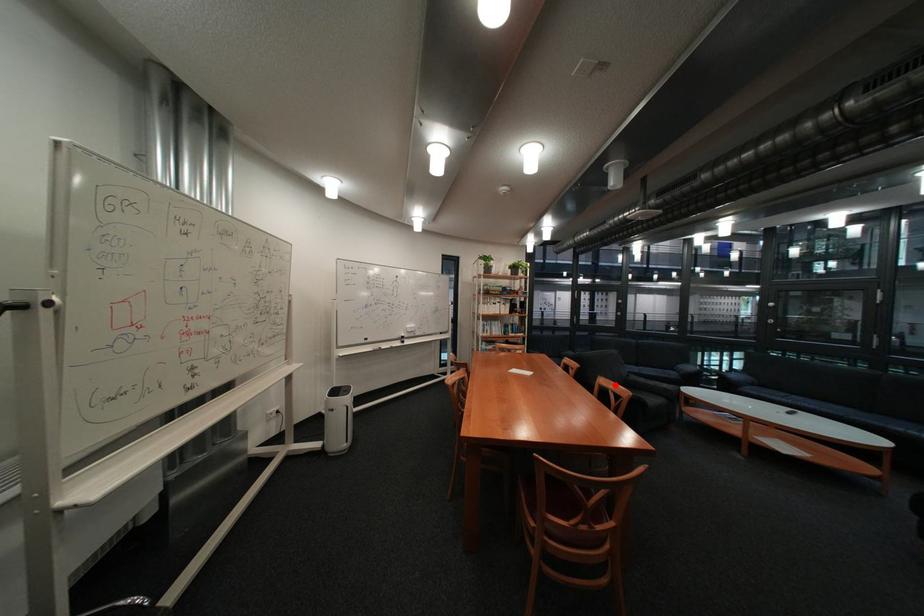
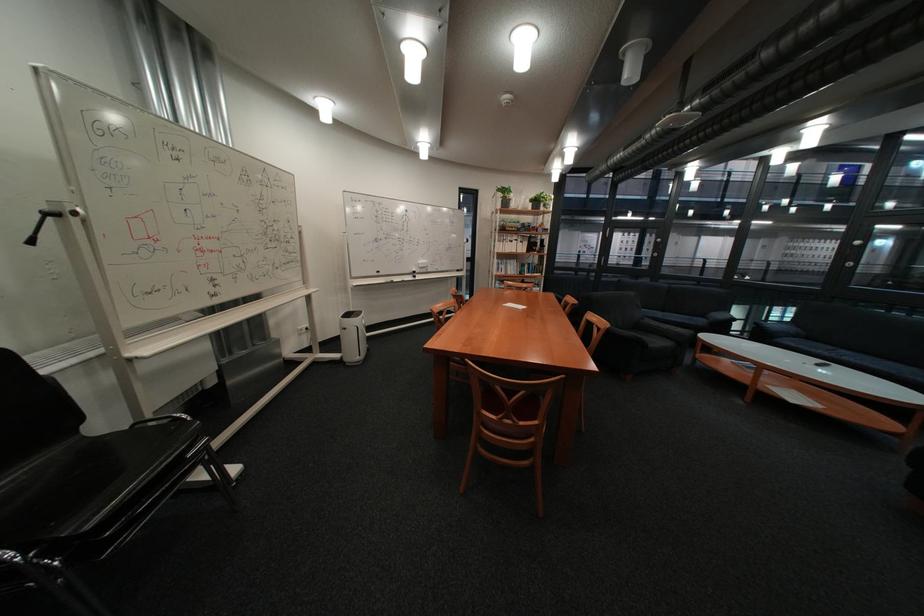
The point at the highlighted location is marked in the first image. Where is the corresponding point in the second image?

(602, 320)